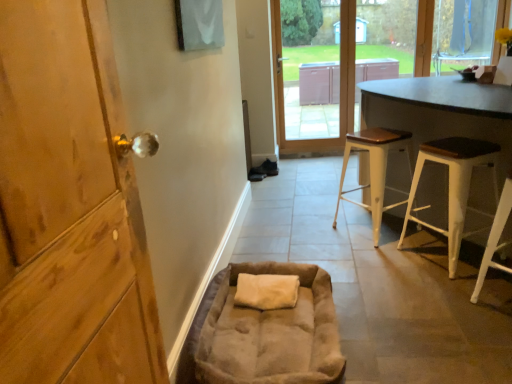
Question: Is white wood stool at lower right, which ranks as the 3th stool in back-to-front order, smaller than dark brown wood table at right?

Choices:
 (A) no
 (B) yes

Answer: (B)

Question: Is white wood stool at lower right, which ranks as the 3th stool in back-to-front order, facing away from dark brown wood table at right?

Choices:
 (A) yes
 (B) no

Answer: (A)

Question: Considering the relative sizes of white wood stool at lower right, which ranks as the 3th stool in back-to-front order, and dark brown wood table at right in the image provided, is white wood stool at lower right, which ranks as the 3th stool in back-to-front order, thinner than dark brown wood table at right?

Choices:
 (A) yes
 (B) no

Answer: (A)

Question: Does white wood stool at lower right, which ranks as the 3th stool in back-to-front order, come in front of dark brown wood table at right?

Choices:
 (A) yes
 (B) no

Answer: (B)

Question: Is white wood stool at lower right, the first stool in the front-to-back sequence, at the right side of dark brown wood table at right?

Choices:
 (A) no
 (B) yes

Answer: (A)

Question: In the image, is suede-like beige bean bag chair at lower center positioned in front of or behind dark brown wood table at right?

Choices:
 (A) front
 (B) behind

Answer: (B)

Question: Does point (220, 364) appear closer or farther from the camera than point (446, 178)?

Choices:
 (A) closer
 (B) farther

Answer: (A)

Question: Is suede-like beige bean bag chair at lower center taller or shorter than dark brown wood table at right?

Choices:
 (A) tall
 (B) short

Answer: (B)

Question: In terms of size, does suede-like beige bean bag chair at lower center appear bigger or smaller than dark brown wood table at right?

Choices:
 (A) small
 (B) big

Answer: (A)

Question: Considering the positions of point (507, 109) and point (465, 11), is point (507, 109) closer or farther from the camera than point (465, 11)?

Choices:
 (A) closer
 (B) farther

Answer: (A)

Question: Considering the positions of dark brown wood table at right and transparent glass window at upper right in the image, is dark brown wood table at right taller or shorter than transparent glass window at upper right?

Choices:
 (A) tall
 (B) short

Answer: (A)

Question: From a real-world perspective, relative to transparent glass window at upper right, is dark brown wood table at right vertically above or below?

Choices:
 (A) above
 (B) below

Answer: (B)

Question: Is dark brown wood table at right spatially inside transparent glass window at upper right, or outside of it?

Choices:
 (A) inside
 (B) outside

Answer: (B)

Question: Looking at the image, does suede-like beige bean bag chair at lower center seem bigger or smaller compared to white wood stool at center, the third stool in the front-to-back sequence?

Choices:
 (A) big
 (B) small

Answer: (B)

Question: Considering the positions of suede-like beige bean bag chair at lower center and white wood stool at center, positioned as the 1th stool in back-to-front order, in the image, is suede-like beige bean bag chair at lower center taller or shorter than white wood stool at center, positioned as the 1th stool in back-to-front order,?

Choices:
 (A) tall
 (B) short

Answer: (B)